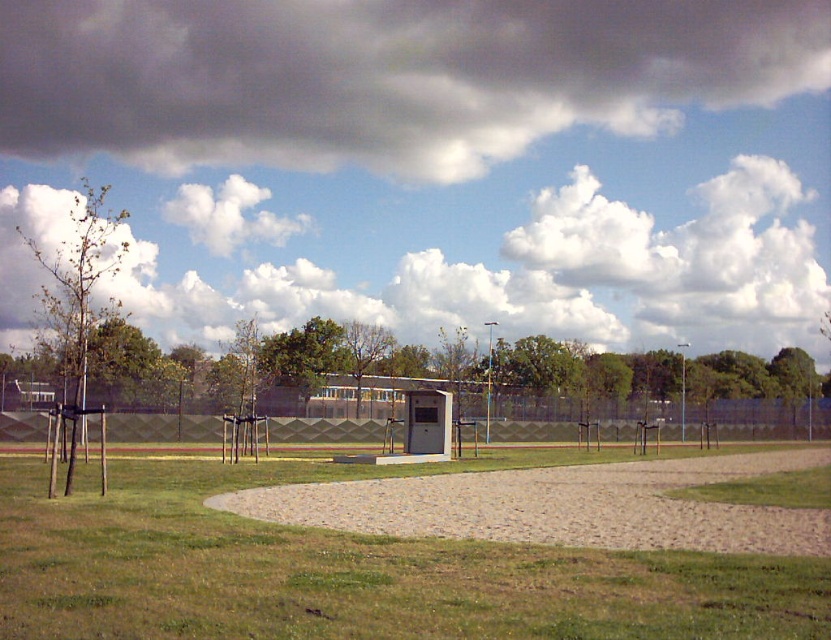
Does green grass at center have a lesser width compared to brown gravel at center?

Yes.

Does point (91, 577) come behind point (557, 492)?

That is False.

This screenshot has height=640, width=831. Describe the element at coordinates (348, 572) in the screenshot. I see `green grass at center` at that location.

The width and height of the screenshot is (831, 640). Find the location of `green grass at center`. green grass at center is located at coordinates (348, 572).